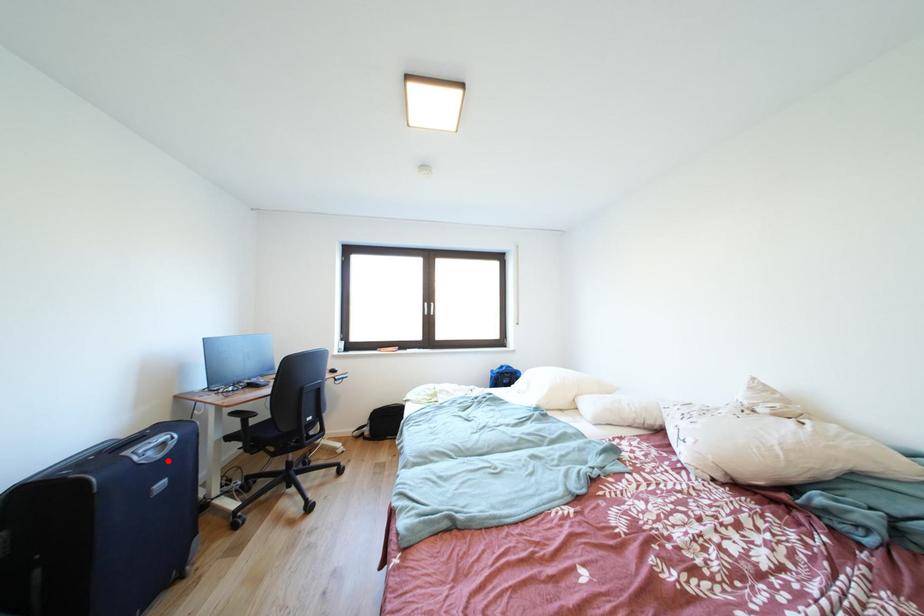
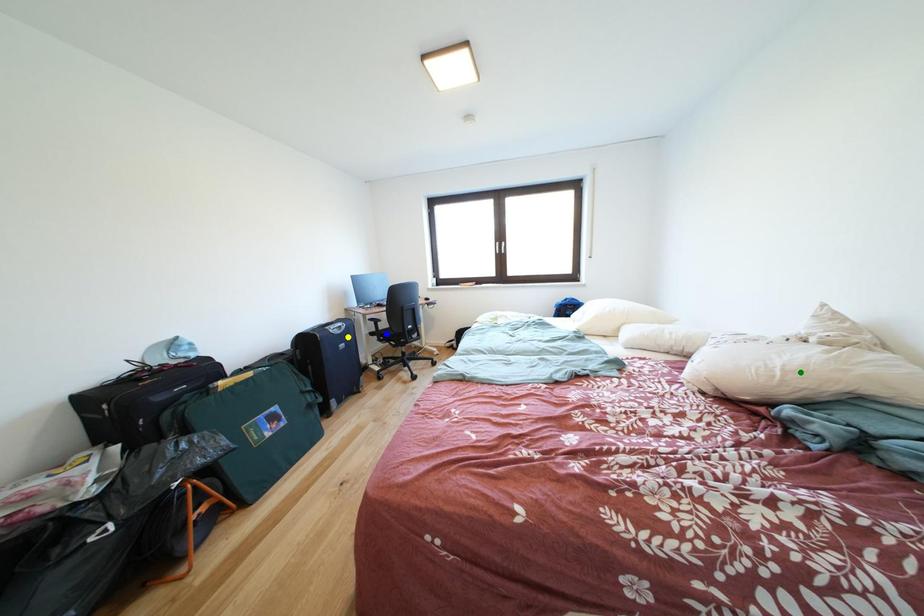
Question: I am providing you with two images of the same scene from different viewpoints. A red point is marked on the first image. You are given multiple points on the second image. Which mark in image 2 goes with the point in image 1?

Choices:
 (A) blue point
 (B) yellow point
 (C) green point

Answer: (B)